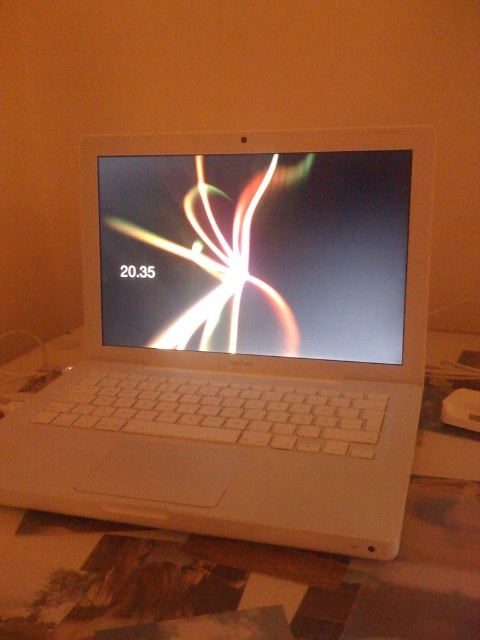
You are holding a smartphone that is 6 inches wide and want to place it next to the white plastic laptop at center. Given the distance between the laptop and your current position, can you estimate if there is enough space to place the smartphone beside the laptop without moving it?

The distance between the white plastic laptop at center and the camera is 12.62 inches. Since the smartphone is 6 inches wide, there is sufficient space to place it beside the laptop without moving it, as the distance is greater than the smartphone width.

You are setting up a new lamp for your desk. You have a matte plastic screen at center and a white plastic table at center. Which object should you place the lamp in front of to ensure it illuminates the screen properly?

The white plastic table at center is behind the matte plastic screen at center, so placing the lamp in front of the matte plastic screen at center will ensure it is properly illuminated.

You are setting up a workspace and need to place a plant between the white plastic laptop at center and the matte plastic screen at center. According to the image, which side of the laptop should you place the plant to ensure it is between them?

The white plastic laptop at center is to the left of the matte plastic screen at center, so placing the plant to the right side of the white plastic laptop at center would position it between them.